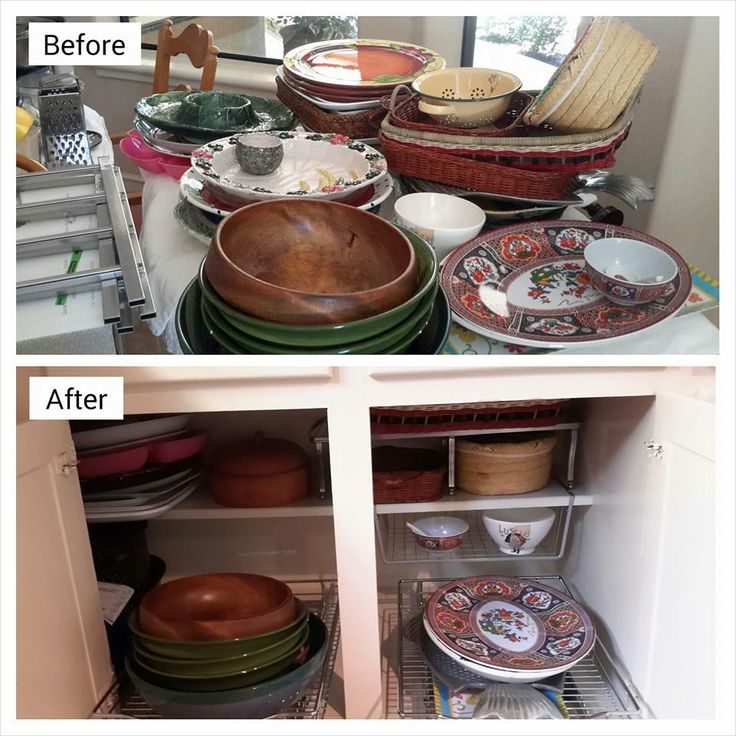
What are the coordinates of `dishes` in the screenshot? It's located at (514, 286), (333, 165), (360, 67), (169, 121), (466, 622).